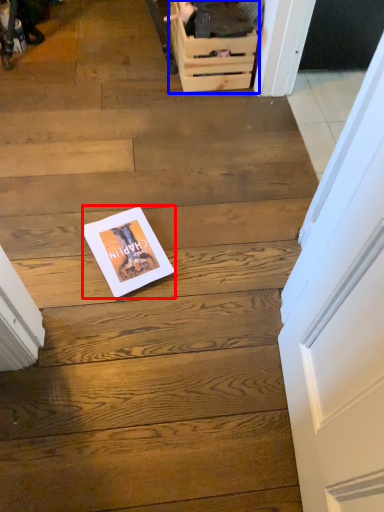
Question: Which object appears closest to the camera in this image, magazine (highlighted by a red box) or drawer (highlighted by a blue box)?

Choices:
 (A) magazine
 (B) drawer

Answer: (A)